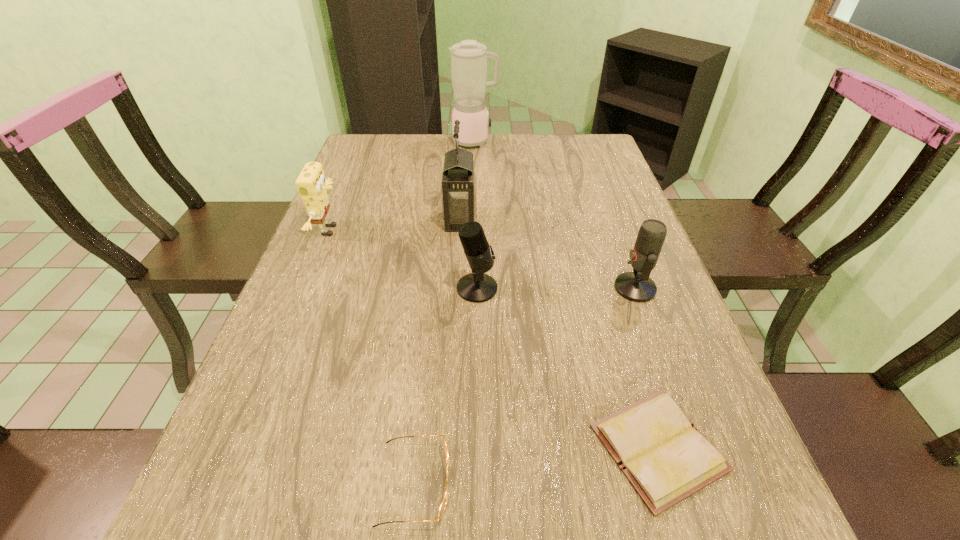
What are the coordinates of `unoccupied position between the diary and the leftmost object` in the screenshot? It's located at (494, 339).

Identify the location of free spot between the left microphone and the right microphone. The image size is (960, 540). (556, 288).

The width and height of the screenshot is (960, 540). I want to click on free space between the right microphone and the spectacles, so click(x=525, y=386).

This screenshot has height=540, width=960. In order to click on vacant area that lies between the shortest object and the second tallest object in this screenshot , I will do `click(559, 334)`.

The width and height of the screenshot is (960, 540). I want to click on free space between the spectacles and the shortest object, so click(537, 465).

Image resolution: width=960 pixels, height=540 pixels. In order to click on unoccupied position between the sixth shortest object and the right microphone in this screenshot , I will do `click(547, 254)`.

Where is `object that is the second closest to the sponge`? The height and width of the screenshot is (540, 960). object that is the second closest to the sponge is located at coordinates (476, 287).

Select which object is the fourth closest to the sponge. Please provide its 2D coordinates. Your answer should be formatted as a tuple, i.e. [(x, y)], where the tuple contains the x and y coordinates of a point satisfying the conditions above.

[(443, 504)]

Image resolution: width=960 pixels, height=540 pixels. I want to click on vacant region that satisfies the following two spatial constraints: 1. on the stand of the left microphone; 2. on the back side of the shortest object, so click(476, 448).

The image size is (960, 540). In order to click on vacant space that satisfies the following two spatial constraints: 1. on the stand of the left microphone; 2. on the back side of the diary in this screenshot , I will do `click(476, 448)`.